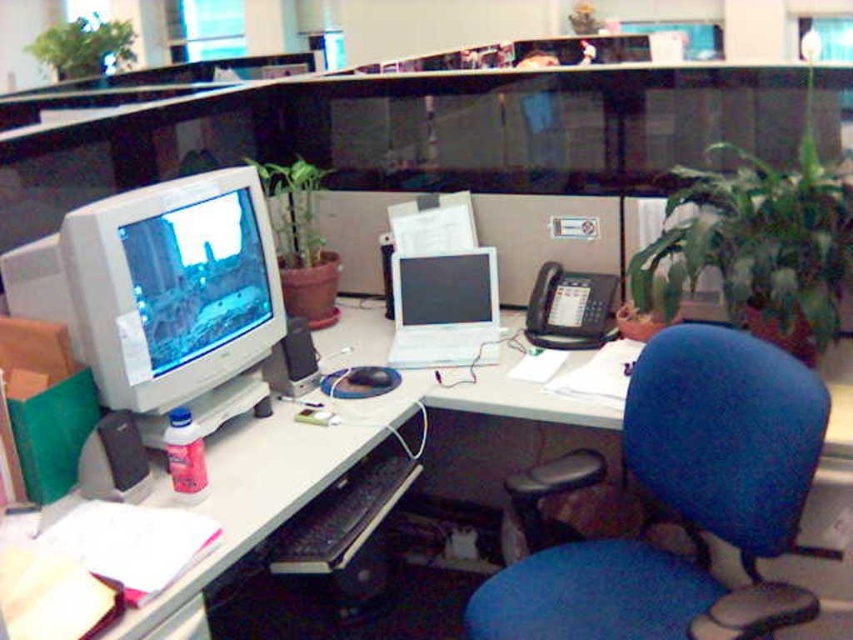
You are standing in front of the office desk and want to pick up an item located at point [479,276] and another item at point [122,54]. Which item will you reach first?

You will reach the item at point [479,276] first because it is closer to you than the item at point [122,54].